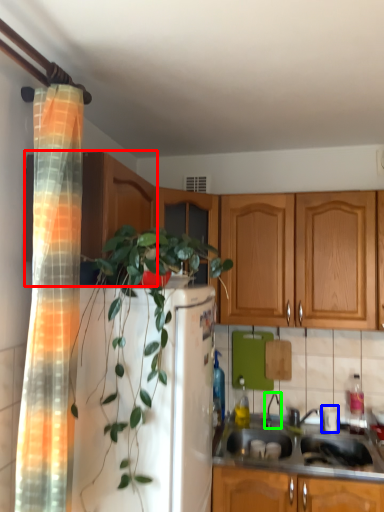
Question: Which object is the farthest from cabinetry (highlighted by a red box)? Choose among these: appliance (highlighted by a blue box) or faucet (highlighted by a green box).

Choices:
 (A) appliance
 (B) faucet

Answer: (A)